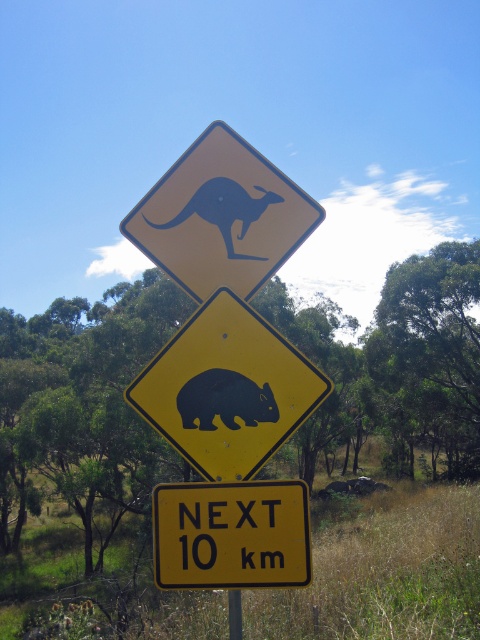
Which is in front, point (294, 529) or point (189, 380)?

Point (294, 529)

Is point (248, 528) in front of point (206, 413)?

Yes, it is in front of point (206, 413).

You are a GUI agent. You are given a task and a screenshot of the screen. Output one action in this format:
    pyautogui.click(x=<x>, y=<y>)
    Task: Click on the yellow/yellowish paper at center
    The image size is (480, 640).
    Given the screenshot: What is the action you would take?
    pyautogui.click(x=230, y=534)

Who is more distant from viewer, (x=201, y=292) or (x=283, y=572)?

The point (x=201, y=292) is more distant.

Is point (288, 228) positioned before point (250, 500)?

No.

Find the location of a particular element. The image size is (480, 640). yellow matte kangaroo at upper center is located at coordinates (222, 216).

Does yellow matte kangaroo at upper center have a greater height compared to black matte kangaroo at upper center?

Yes, yellow matte kangaroo at upper center is taller than black matte kangaroo at upper center.

Can you confirm if yellow matte kangaroo at upper center is wider than black matte kangaroo at upper center?

Correct, the width of yellow matte kangaroo at upper center exceeds that of black matte kangaroo at upper center.

Image resolution: width=480 pixels, height=640 pixels. In order to click on yellow matte kangaroo at upper center in this screenshot , I will do `click(222, 216)`.